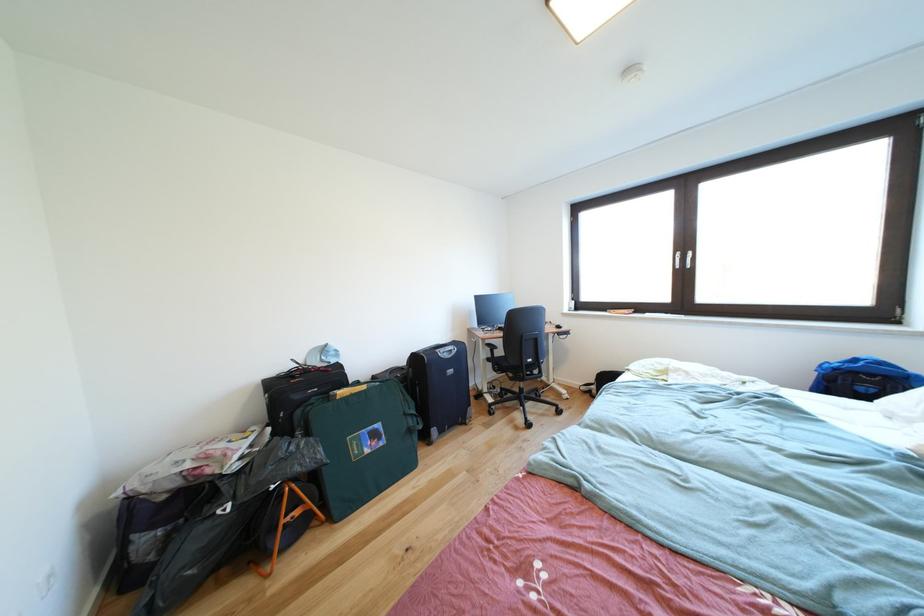
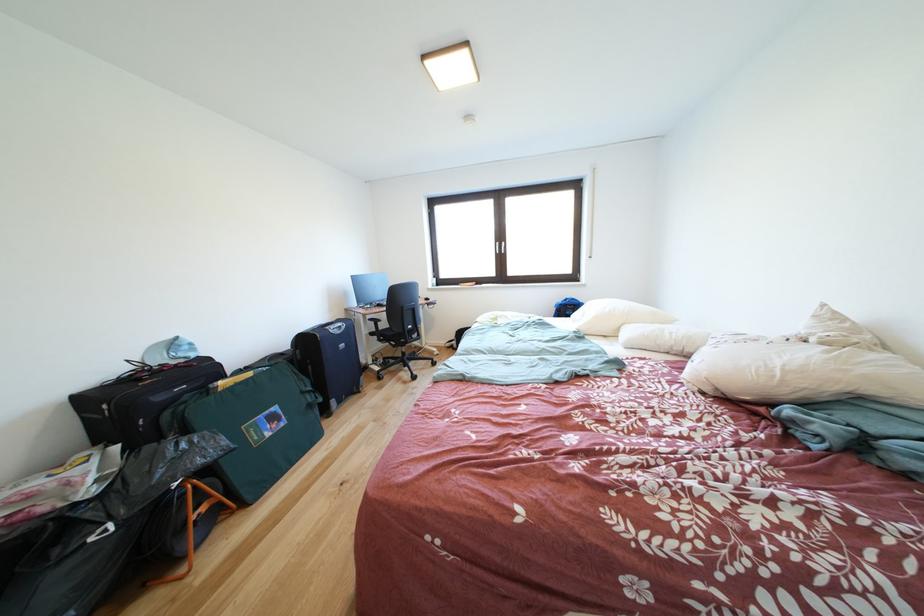
Locate, in the second image, the point that corresponds to point (335, 376) in the first image.

(200, 371)